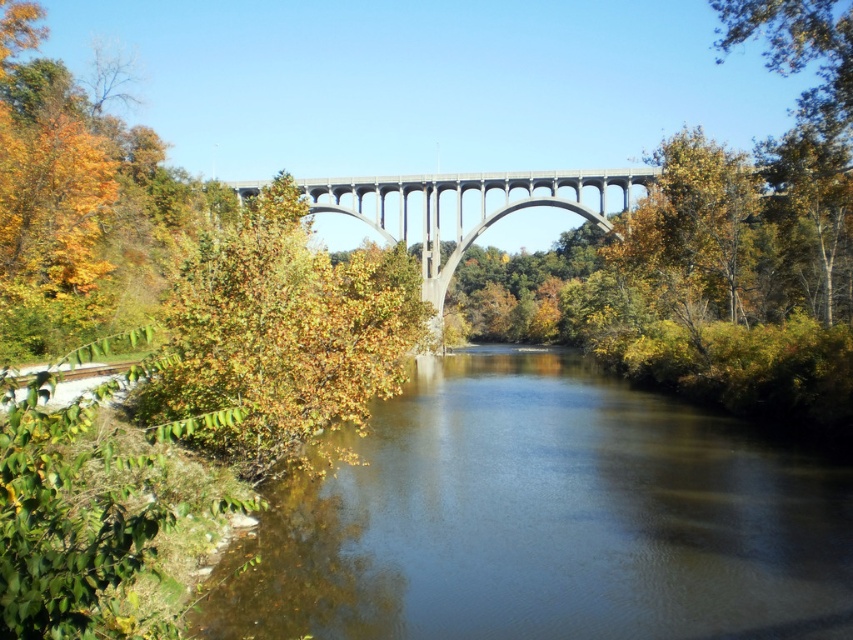
You are standing on the bridge looking towards the river. There are two points marked on the bridge deck. One is at coordinate point (606, 628) and the other at point (628, 176). Which point is closer to you as you face the river?

The point (606, 628) is closer to the viewer than point (628, 176).

You are standing on the concrete bridge at center and want to take a photo of the green leafy tree at left. Which direction should you face to capture the tree in your shot?

You should face to the left side of the concrete bridge at center to capture the green leafy tree at left in your shot since it is positioned on the left side of the concrete bridge at center according to the description.